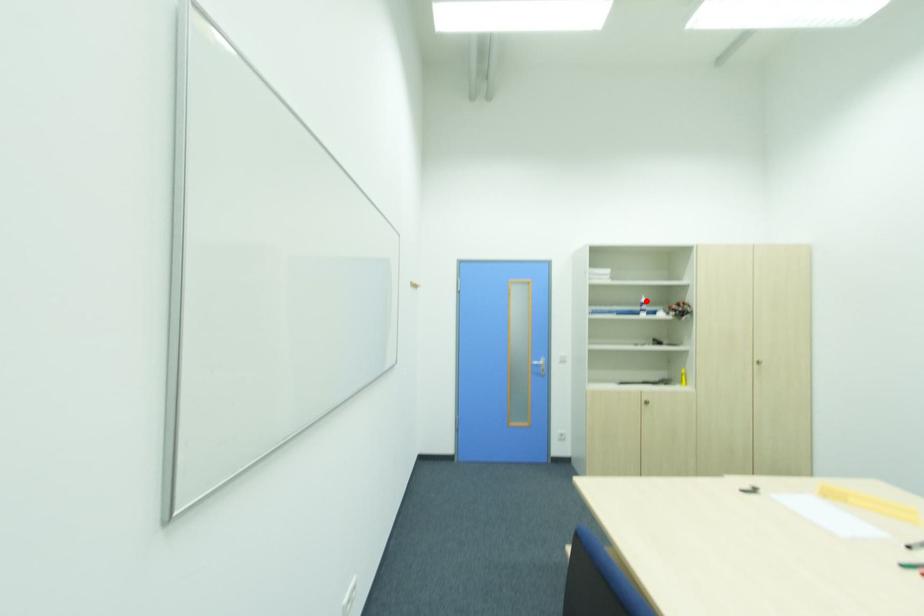
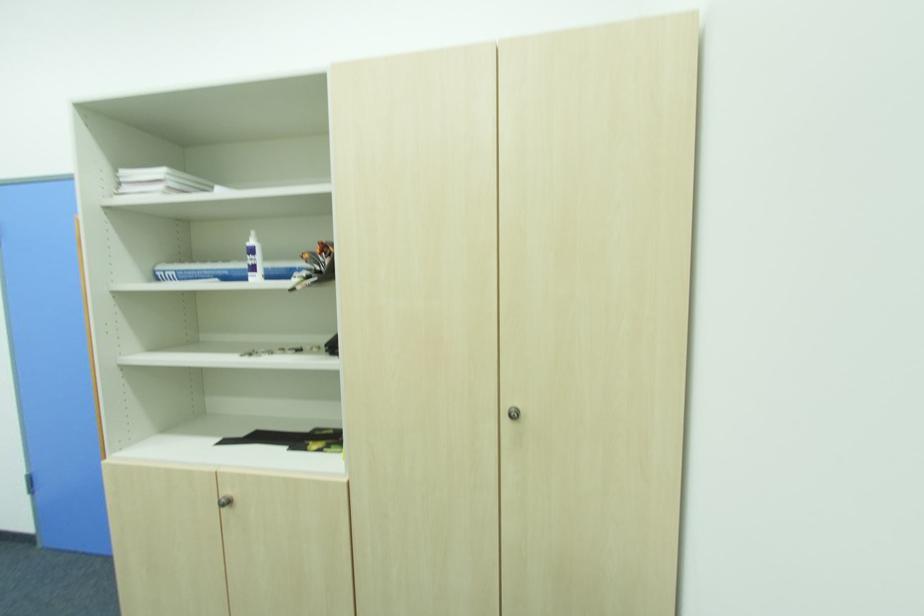
Find the pixel in the second image that matches the highlighted location in the first image.

(254, 243)